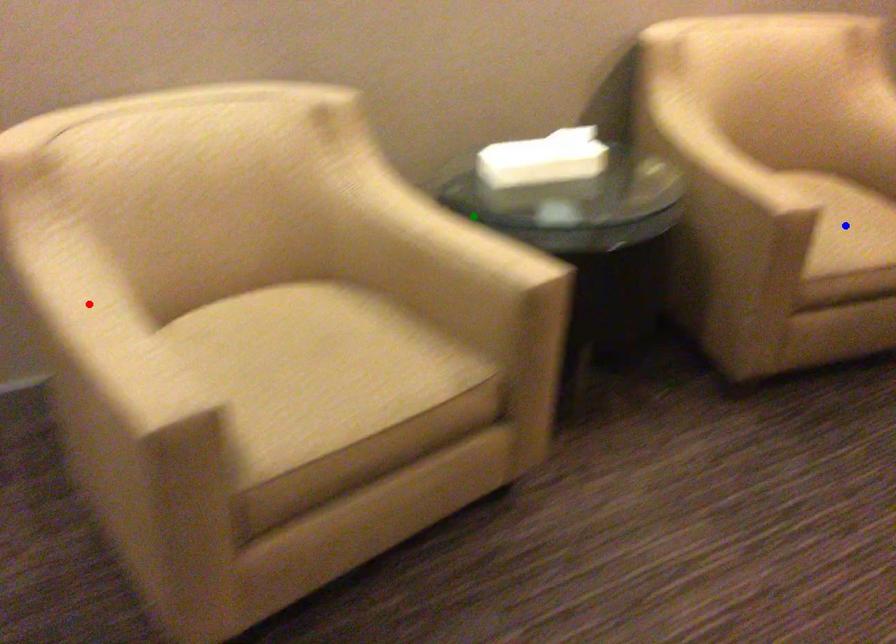
Order these from nearest to farthest:
A) blue point
B) red point
C) green point

red point, green point, blue point